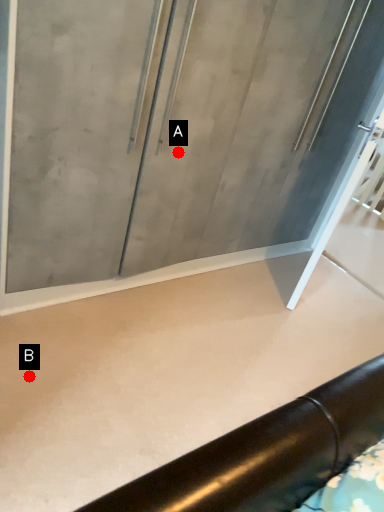
Question: Two points are circled on the image, labeled by A and B beside each circle. Which point is closer to the camera?

Choices:
 (A) A is closer
 (B) B is closer

Answer: (B)